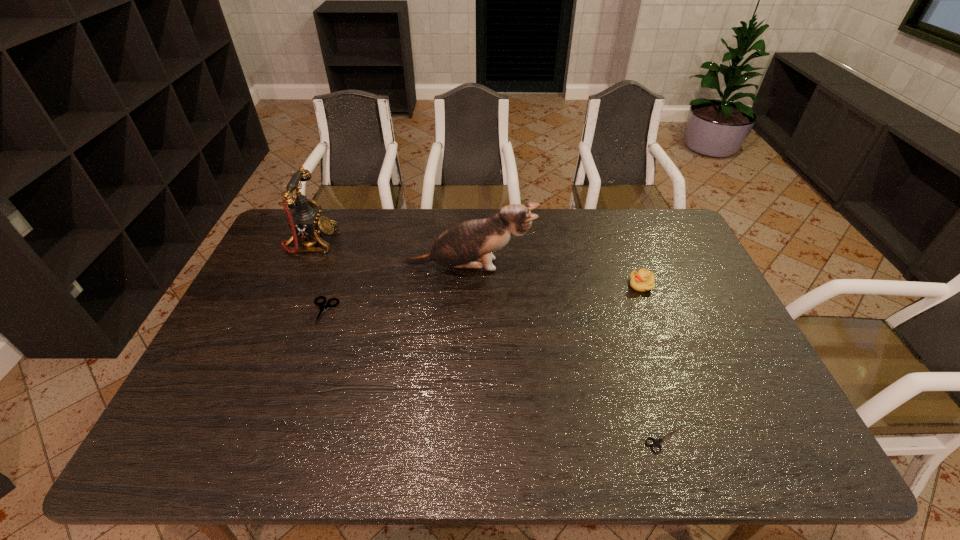
At what (x,y) coordinates should I click in order to perform the action: click on the leftmost object. Please return your answer as a coordinate pair (x, y). This screenshot has height=540, width=960. Looking at the image, I should click on (306, 222).

This screenshot has width=960, height=540. What are the coordinates of `cat` in the screenshot? It's located at (474, 240).

Locate an element on the screen. The image size is (960, 540). duckling is located at coordinates (643, 280).

Locate an element on the screen. the second object from left to right is located at coordinates (322, 306).

Image resolution: width=960 pixels, height=540 pixels. Identify the location of the fourth tallest object. (322, 306).

Locate an element on the screen. Image resolution: width=960 pixels, height=540 pixels. the nearest object is located at coordinates (657, 442).

At what (x,y) coordinates should I click in order to perform the action: click on the right shears. Please return your answer as a coordinate pair (x, y). Looking at the image, I should click on click(x=657, y=442).

At what (x,y) coordinates should I click in order to perform the action: click on vacant area situated 0.240m on the front of the leftmost object, featuring the rotary dial. Please return your answer as a coordinate pair (x, y). Image resolution: width=960 pixels, height=540 pixels. Looking at the image, I should click on (405, 242).

Locate an element on the screen. free region located at the face of the cat is located at coordinates (551, 266).

Locate an element on the screen. This screenshot has height=540, width=960. free region located on the front-facing side of the third tallest object is located at coordinates (519, 285).